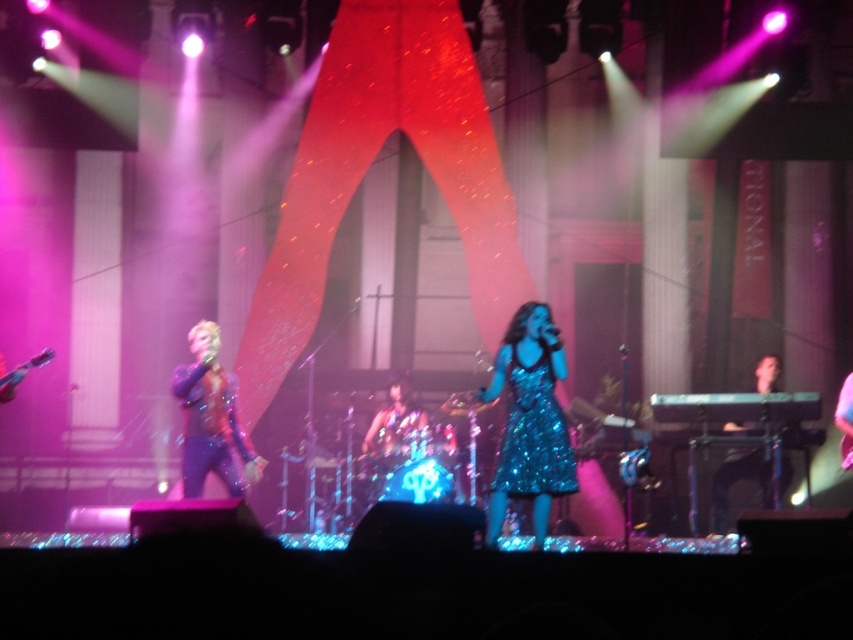
You are a photographer standing at the center of the stage. You want to take a photo of the sparkly purple dress at left. Where should you aim your camera to capture it?

You should aim your camera at the coordinates point (212, 419) to capture the sparkly purple dress at left.

You are a stagehand who needs to move a 30 feet long extension cord from the camera to the black glossy keyboard at right. Can you safely lay the cord without it being a tripping hazard for the performers?

The distance between the camera and the black glossy keyboard at right is 29.67 feet. Since the extension cord is 30 feet long, it would be slightly longer than the required distance. However, laying a 30 feet cord over a 29.67 feet gap would leave a small amount of slack. To avoid a tripping hazard, the excess cord should be coiled or secured properly to keep it off the floor. Alternatively, using the full length might still be manageable if placed carefully, but caution is needed to ensure it doesn

You are a photographer positioned at the back of the venue. You want to capture a photo that includes both the black glossy keyboard at right and the shiny blue dress at center. Given that your camera has a maximum focus range of 3 meters, will you be able to capture both objects in focus at the same time?

The black glossy keyboard at right is 3.28 meters away from the shiny blue dress at center. Since your camera can only focus up to 3 meters, the distance between them exceeds the maximum focus range. Therefore, you won